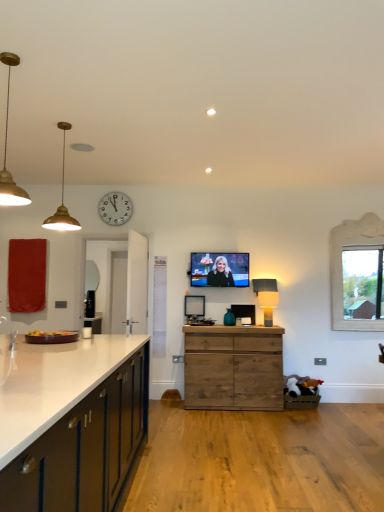
Locate an element on the screen. The width and height of the screenshot is (384, 512). vacant space situated above gold metallic pendant light at left, the third lamp from the right (from a real-world perspective) is located at coordinates (16, 57).